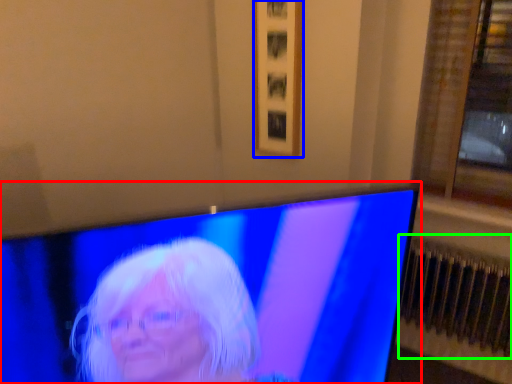
Question: Which object is positioned closest to television (highlighted by a red box)? Select from picture frame (highlighted by a blue box) and radiator (highlighted by a green box).

Choices:
 (A) picture frame
 (B) radiator

Answer: (A)